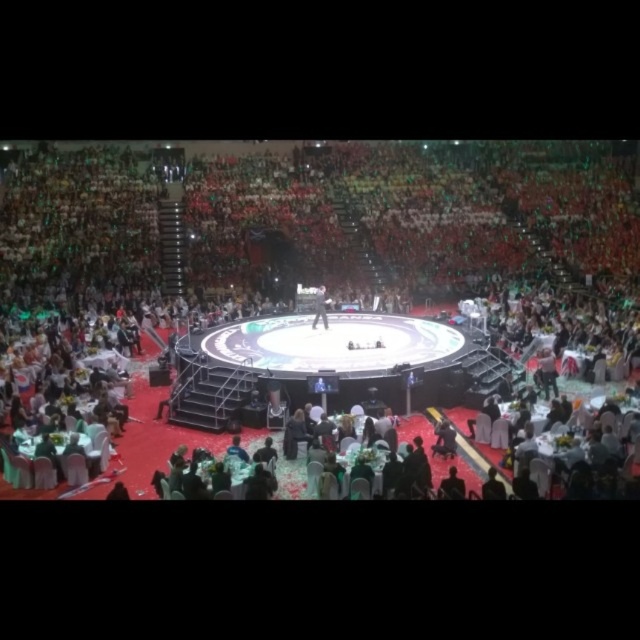
You are a stagehand preparing to adjust the microphone stand. You notice the black glossy microphone at center and the black fabric person at center. Which object is positioned higher in relation to the other?

The black glossy microphone at center is located above the black fabric person at center.

You are an event planner trying to place a new speaker at the exact center of the stage. The stage is a perfect circle with a diameter of 10 meters. The black glossy microphone at center is already placed at coordinates 0.483, 0.473. Is the microphone positioned exactly at the center of the stage?

The black glossy microphone at center is placed at coordinates (301, 308). Since the stage is a perfect circle with a diameter of 10 meters, the exact center would be at coordinates (320, 320). The microphone is slightly off the center, so it is not positioned exactly at the center of the stage.

You are a stagehand preparing to set up equipment for the event. You need to place a new microphone stand that is 1.5 meters tall. Considering the black glossy microphone at center and the black fabric person at center, which object is larger and would require more space?

The black glossy microphone at center is bigger than the black fabric person at center, so it would require more space.